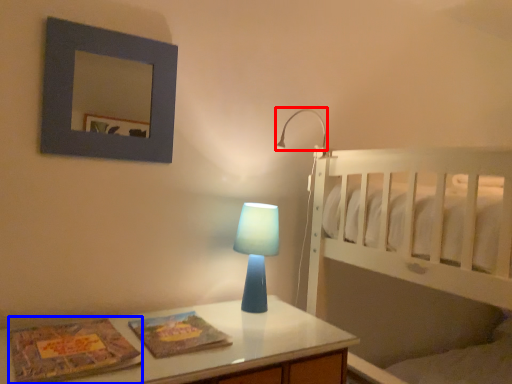
Question: Which point is further to the camera, lamp (highlighted by a red box) or magazine (highlighted by a blue box)?

Choices:
 (A) lamp
 (B) magazine

Answer: (A)